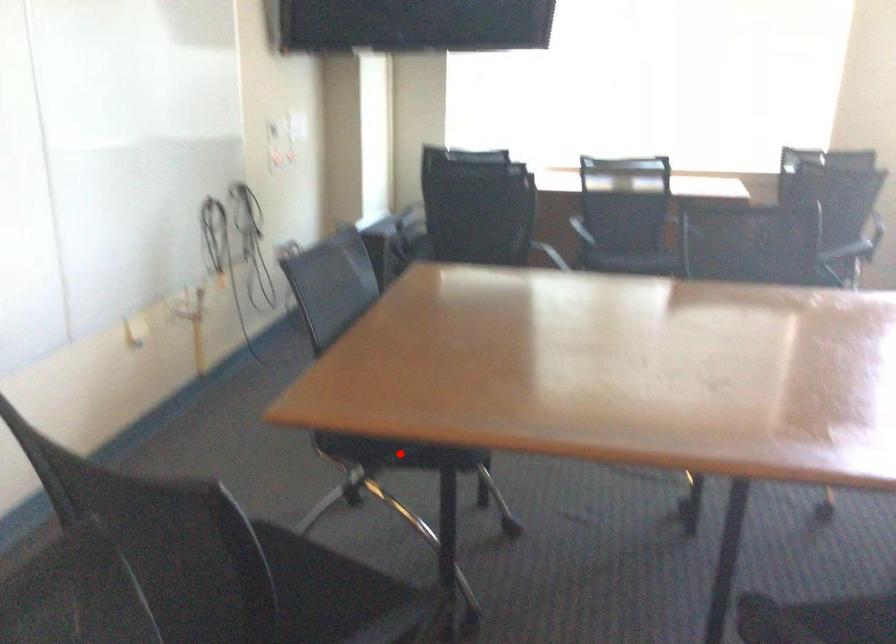
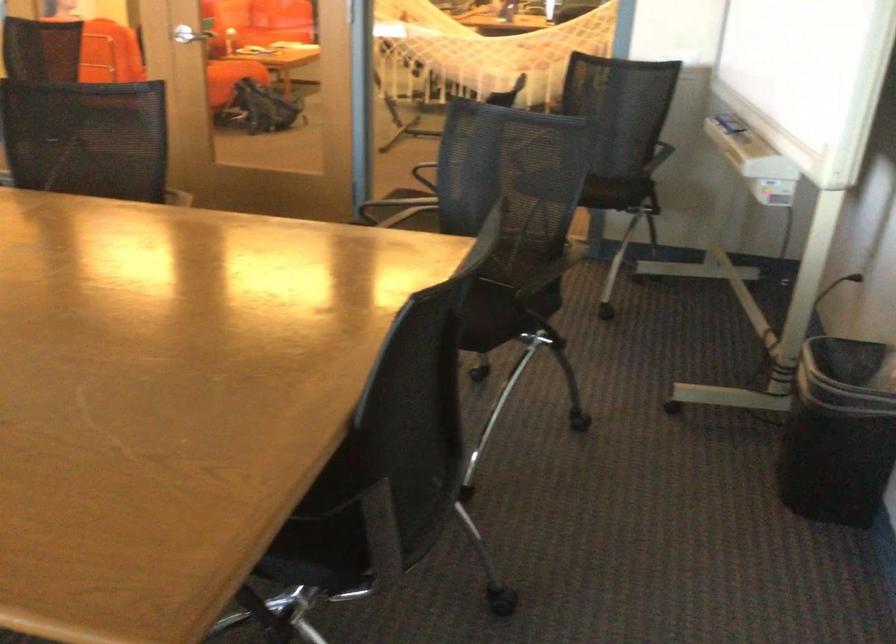
Question: I am providing you with two images of the same scene from different viewpoints. A red point is marked on the first image. Can you still see the location of the red point in image 2?

Choices:
 (A) Yes
 (B) No

Answer: (B)